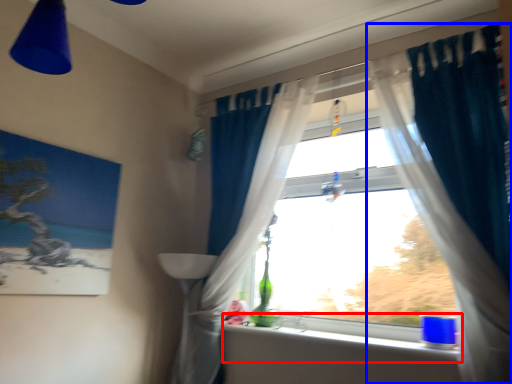
Question: Which of the following is the closest to the observer, window sill (highlighted by a red box) or curtain (highlighted by a blue box)?

Choices:
 (A) window sill
 (B) curtain

Answer: (B)